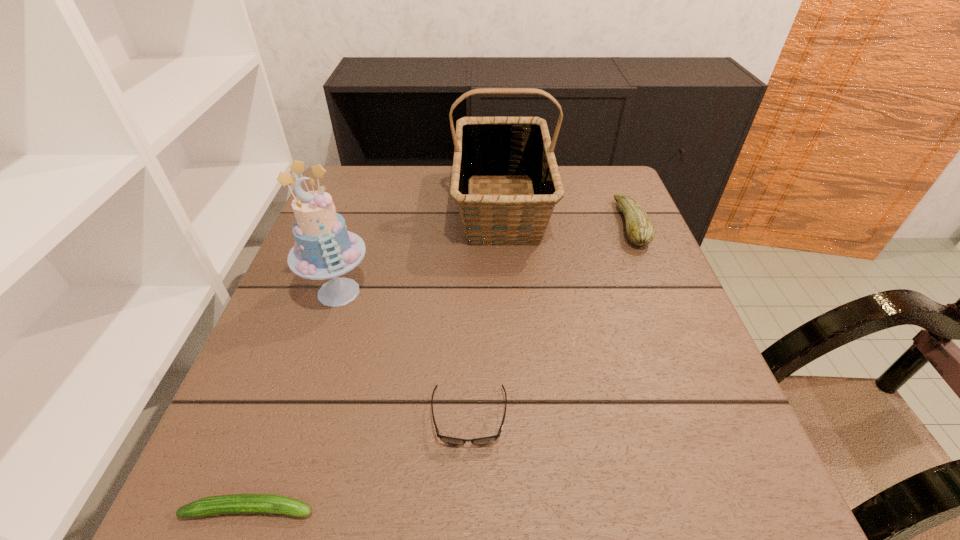
Find the location of `unoccupied area between the cake and the fourth tallest object`. unoccupied area between the cake and the fourth tallest object is located at coordinates (404, 355).

At what (x,y) coordinates should I click in order to perform the action: click on free space that is in between the second nearest object and the basket. Please return your answer as a coordinate pair (x, y). The image size is (960, 540). Looking at the image, I should click on (486, 312).

In order to click on vacant space that is in between the right zucchini and the third farthest object in this screenshot , I will do `click(485, 258)`.

I want to click on vacant area that lies between the farther zucchini and the third farthest object, so click(485, 258).

At what (x,y) coordinates should I click in order to perform the action: click on vacant region between the basket and the shorter zucchini. Please return your answer as a coordinate pair (x, y). The image size is (960, 540). Looking at the image, I should click on (376, 358).

Locate an element on the screen. This screenshot has width=960, height=540. free area in between the nearest object and the rightmost object is located at coordinates (440, 367).

You are a GUI agent. You are given a task and a screenshot of the screen. Output one action in this format:
    pyautogui.click(x=<x>, y=<y>)
    Task: Click on the vacant area between the basket and the nearest object
    This screenshot has height=540, width=960.
    Given the screenshot: What is the action you would take?
    pyautogui.click(x=376, y=358)

Locate an element on the screen. Image resolution: width=960 pixels, height=540 pixels. vacant area that lies between the taller zucchini and the fourth farthest object is located at coordinates (550, 321).

At what (x,y) coordinates should I click in order to perform the action: click on free space between the third tallest object and the cake. Please return your answer as a coordinate pair (x, y). Looking at the image, I should click on [485, 258].

At what (x,y) coordinates should I click in order to perform the action: click on object that is the fourth nearest to the taller zucchini. Please return your answer as a coordinate pair (x, y). This screenshot has height=540, width=960. Looking at the image, I should click on (236, 503).